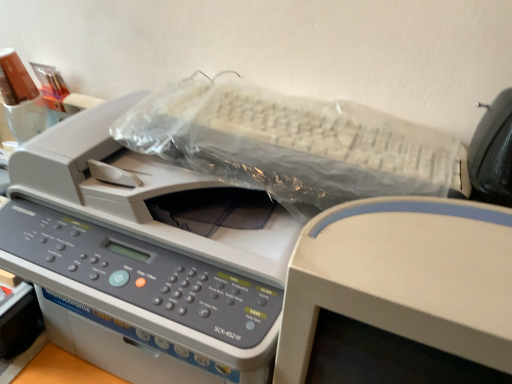
Question: In the image, is white plastic monitor at upper center on the left side or the right side of white plastic printer at center?

Choices:
 (A) right
 (B) left

Answer: (A)

Question: Is white plastic monitor at upper center taller or shorter than white plastic printer at center?

Choices:
 (A) short
 (B) tall

Answer: (B)

Question: Is white plastic monitor at upper center bigger or smaller than white plastic printer at center?

Choices:
 (A) big
 (B) small

Answer: (B)

Question: From the image's perspective, is white plastic printer at center above or below white plastic monitor at upper center?

Choices:
 (A) above
 (B) below

Answer: (A)

Question: From a real-world perspective, is white plastic printer at center physically located above or below white plastic monitor at upper center?

Choices:
 (A) above
 (B) below

Answer: (B)

Question: Considering the positions of white plastic printer at center and white plastic monitor at upper center in the image, is white plastic printer at center bigger or smaller than white plastic monitor at upper center?

Choices:
 (A) small
 (B) big

Answer: (B)

Question: Is point (266, 256) closer or farther from the camera than point (350, 274)?

Choices:
 (A) farther
 (B) closer

Answer: (A)